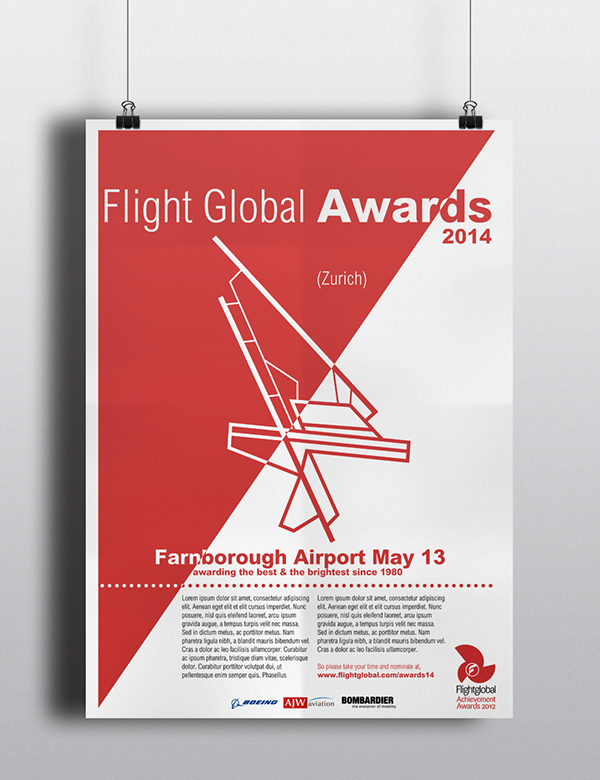
I want to click on hanging poster, so click(347, 122).